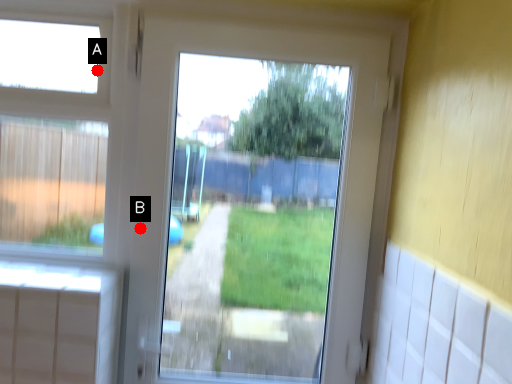
Question: Two points are circled on the image, labeled by A and B beside each circle. Which point is farther from the camera taking this photo?

Choices:
 (A) A is further
 (B) B is further

Answer: (A)